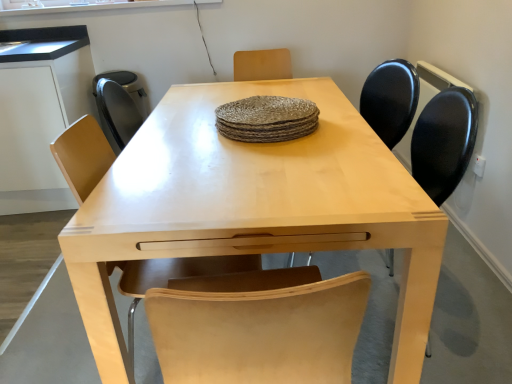
Question: Is matte black chair at center, the first chair viewed from the right, shorter than rustic woven placemat at center?

Choices:
 (A) no
 (B) yes

Answer: (A)

Question: Does matte black chair at center, the first chair viewed from the right, have a greater height compared to rustic woven placemat at center?

Choices:
 (A) no
 (B) yes

Answer: (B)

Question: Can you confirm if matte black chair at center, the second chair in the left-to-right sequence, is positioned to the right of rustic woven placemat at center?

Choices:
 (A) yes
 (B) no

Answer: (A)

Question: Does matte black chair at center, the first chair viewed from the right, turn towards rustic woven placemat at center?

Choices:
 (A) no
 (B) yes

Answer: (B)

Question: Is matte black chair at center, the first chair viewed from the right, to the left of rustic woven placemat at center from the viewer's perspective?

Choices:
 (A) yes
 (B) no

Answer: (B)

Question: In terms of size, does light brown wood chair at center, the first chair from the left, appear bigger or smaller than matte black chair at center, the second chair in the left-to-right sequence?

Choices:
 (A) big
 (B) small

Answer: (A)

Question: Is light brown wood chair at center, the first chair from the left, situated inside matte black chair at center, the first chair viewed from the right, or outside?

Choices:
 (A) inside
 (B) outside

Answer: (B)

Question: Considering the positions of point (173, 269) and point (432, 162), is point (173, 269) closer or farther from the camera than point (432, 162)?

Choices:
 (A) closer
 (B) farther

Answer: (A)

Question: Looking at their shapes, would you say light brown wood chair at center, the first chair from the left, is wider or thinner than matte black chair at center, the first chair viewed from the right?

Choices:
 (A) thin
 (B) wide

Answer: (A)

Question: In the image, is matte black chair at center, the second chair in the left-to-right sequence, on the left side or the right side of rustic woven placemat at center?

Choices:
 (A) right
 (B) left

Answer: (A)

Question: From their relative heights in the image, would you say matte black chair at center, the second chair in the left-to-right sequence, is taller or shorter than rustic woven placemat at center?

Choices:
 (A) short
 (B) tall

Answer: (B)

Question: Relative to rustic woven placemat at center, is matte black chair at center, the first chair viewed from the right, in front or behind?

Choices:
 (A) front
 (B) behind

Answer: (B)

Question: Choose the correct answer: Is matte black chair at center, the second chair in the left-to-right sequence, inside rustic woven placemat at center or outside it?

Choices:
 (A) outside
 (B) inside

Answer: (A)

Question: Considering the positions of matte black chair at center, the second chair in the left-to-right sequence, and matte black computer desk at left in the image, is matte black chair at center, the second chair in the left-to-right sequence, wider or thinner than matte black computer desk at left?

Choices:
 (A) thin
 (B) wide

Answer: (A)

Question: From a real-world perspective, is matte black chair at center, the second chair in the left-to-right sequence, physically located above or below matte black computer desk at left?

Choices:
 (A) above
 (B) below

Answer: (B)